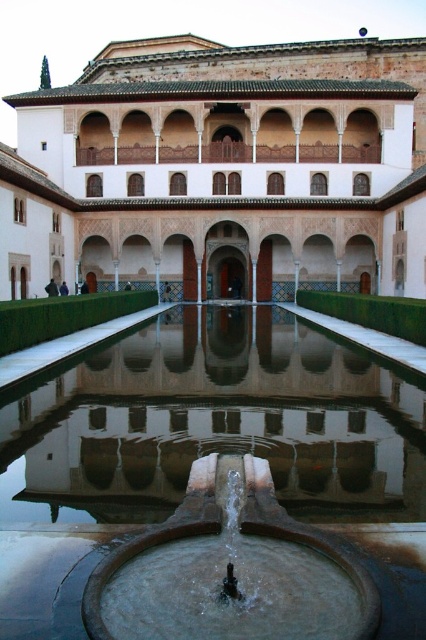
In the scene shown: You are a visitor in the courtyard and want to know the distance between the brown stone fountain at center and the bronze metallic fountain at center. Can you tell me how far they are from each other?

The brown stone fountain at center and the bronze metallic fountain at center are 18.70 feet apart from each other.

You are standing in the courtyard and want to walk to the brown stone fountain at center. There is a stone wall at center blocking your path. Can you go around it to reach the fountain?

The stone wall at center is positioned over brown stone fountain at center, meaning the fountain is located directly underneath the wall. Therefore, you cannot physically reach the brown stone fountain at center as it is obstructed by the stone wall at center.

You are an architect analyzing the courtyard layout. You observe the brown stone fountain at center and the bronze metallic fountain at center. Which one is positioned higher in the image?

The brown stone fountain at center is above the bronze metallic fountain at center, so it is positioned higher in the image.